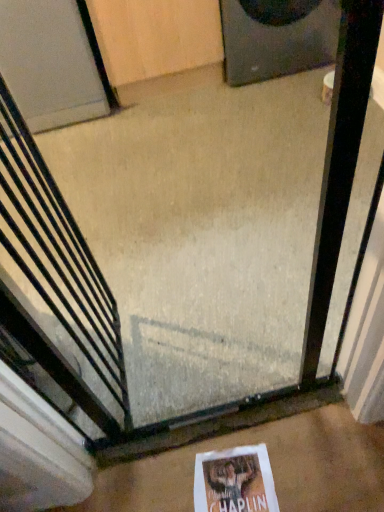
Describe the element at coordinates (277, 37) in the screenshot. I see `black matte speaker at upper right` at that location.

In order to face white paper at lower center, should I rotate leftwards or rightwards?

Turn right approximately 5.844 degrees to face it.

This screenshot has width=384, height=512. I want to click on black metal escalator at center, so click(56, 278).

Can you confirm if white paper at lower center is positioned to the left of black metal escalator at center?

No.

From the image's perspective, which is below, white paper at lower center or black metal escalator at center?

white paper at lower center appears lower in the image.

From a real-world perspective, which is physically above, white paper at lower center or black metal escalator at center?

In real-world perspective, black metal escalator at center is above.

Is black metal escalator at center further to the viewer compared to white matte door at upper left?

No, the depth of black metal escalator at center is less than that of white matte door at upper left.

Looking at the image, does black metal escalator at center seem bigger or smaller compared to white matte door at upper left?

black metal escalator at center is smaller than white matte door at upper left.

From a real-world perspective, which is physically above, black metal escalator at center or white matte door at upper left?

black metal escalator at center is physically above.

Could you tell me if black metal escalator at center is facing white matte door at upper left?

No, black metal escalator at center is not facing towards white matte door at upper left.

Based on the photo, from a real-world perspective, is white matte door at upper left physically above white concrete at center?

Yes.

How distant is white matte door at upper left from white concrete at center?

1.82 meters.

Between white matte door at upper left and white concrete at center, which one has larger size?

With larger size is white matte door at upper left.

Relative to white concrete at center, is white matte door at upper left in front or behind?

white matte door at upper left is behind white concrete at center.

Considering the relative positions of white paper at lower center and white concrete at center in the image provided, is white paper at lower center to the right of white concrete at center from the viewer's perspective?

Correct, you'll find white paper at lower center to the right of white concrete at center.

Can you confirm if white paper at lower center is wider than white concrete at center?

Incorrect, the width of white paper at lower center does not surpass that of white concrete at center.

Is white paper at lower center facing away from white concrete at center?

Correct, white paper at lower center is looking away from white concrete at center.

Measure the distance between white paper at lower center and white concrete at center.

white paper at lower center and white concrete at center are 4.01 inches apart.

Would you consider white matte door at upper left to be distant from black metal escalator at center?

Indeed, white matte door at upper left is not near black metal escalator at center.

Is white matte door at upper left at the right side of black metal escalator at center?

No.

Would you say white matte door at upper left contains black metal escalator at center?

No, white matte door at upper left does not contain black metal escalator at center.

Is white paper at lower center oriented away from white matte door at upper left?

No, white paper at lower center is not facing the opposite direction of white matte door at upper left.

Is white paper at lower center wider than white matte door at upper left?

No, white paper at lower center is not wider than white matte door at upper left.

Is there a large distance between white paper at lower center and white matte door at upper left?

Yes, white paper at lower center and white matte door at upper left are located far from each other.

Can you confirm if white matte door at upper left is wider than black matte speaker at upper right?

No.

Locate an element on the screen. door above the black matte speaker at upper right (from a real-world perspective) is located at coordinates (49, 63).

From a real-world perspective, is white matte door at upper left physically located above or below black matte speaker at upper right?

In terms of real-world spatial position, white matte door at upper left is above black matte speaker at upper right.

From the image's perspective, between white matte door at upper left and black matte speaker at upper right, which one is located above?

black matte speaker at upper right, from the image's perspective.

This screenshot has height=512, width=384. I want to click on flyer that is on the right side of black metal escalator at center, so click(235, 481).

Locate an element on the screen. door behind the black metal escalator at center is located at coordinates (49, 63).

Which object lies nearer to the anchor point white matte door at upper left, white paper at lower center or white concrete at center?

The object closer to white matte door at upper left is white concrete at center.

Which object lies further to the anchor point black matte speaker at upper right, black metal escalator at center or white concrete at center?

white concrete at center lies further to black matte speaker at upper right than the other object.

Considering their positions, is black metal escalator at center positioned further to black matte speaker at upper right than white paper at lower center?

white paper at lower center.

Which object lies further to the anchor point black matte speaker at upper right, white concrete at center or white matte door at upper left?

white concrete at center is further to black matte speaker at upper right.

Looking at the image, which one is located further to white paper at lower center, black metal escalator at center or white concrete at center?

black metal escalator at center.

Which object lies nearer to the anchor point white concrete at center, white matte door at upper left or white paper at lower center?

white paper at lower center is closer to white concrete at center.

Estimate the real-world distances between objects in this image. Which object is further from white paper at lower center, white concrete at center or white matte door at upper left?

white matte door at upper left.

Looking at the image, which one is located further to white matte door at upper left, white concrete at center or black matte speaker at upper right?

The object further to white matte door at upper left is white concrete at center.

This screenshot has width=384, height=512. Identify the location of concrete that lies between black matte speaker at upper right and white paper at lower center from top to bottom. (271, 466).

Identify the location of door between black matte speaker at upper right and white concrete at center in the up-down direction. This screenshot has width=384, height=512. (49, 63).

I want to click on door between black matte speaker at upper right and white paper at lower center vertically, so click(x=49, y=63).

You are a GUI agent. You are given a task and a screenshot of the screen. Output one action in this format:
    pyautogui.click(x=<x>, y=<y>)
    Task: Click on the escalator between white matte door at upper left and white paper at lower center vertically
    Image resolution: width=384 pixels, height=512 pixels.
    Given the screenshot: What is the action you would take?
    pyautogui.click(x=56, y=278)